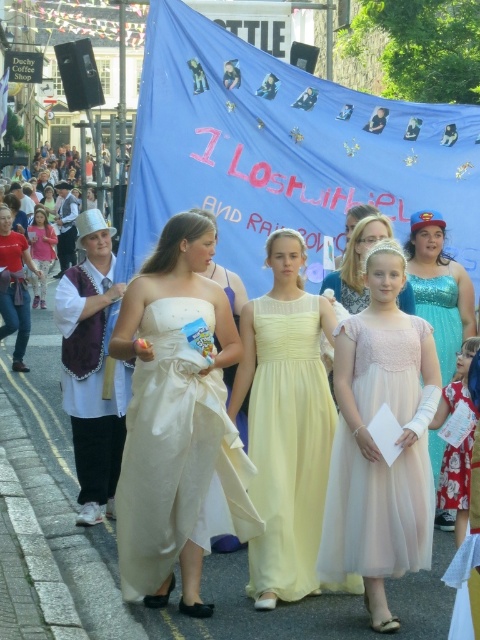
Describe the element at coordinates (286, 422) in the screenshot. I see `light yellow satin dress at center` at that location.

Who is shorter, light yellow satin dress at center or pale pink tulle dress at center?

Standing shorter between the two is light yellow satin dress at center.

Is point (240, 390) closer to viewer compared to point (403, 364)?

No, it is behind (403, 364).

Locate an element on the screen. This screenshot has height=640, width=480. light yellow satin dress at center is located at coordinates (286, 422).

Between ivory satin dress at center and light pink satin dress at center, which one has more height?

light pink satin dress at center

Is ivory satin dress at center behind light pink satin dress at center?

No, it is not.

In order to click on ivory satin dress at center in this screenshot , I will do (178, 420).

Can you confirm if ivory satin dress at center is taller than light yellow satin dress at center?

Correct, ivory satin dress at center is much taller as light yellow satin dress at center.

Between point (202, 237) and point (300, 472), which one is positioned behind?

The point (202, 237) is more distant.

Is point (142, 289) behind point (276, 493)?

That is True.

Locate an element on the screen. ivory satin dress at center is located at coordinates (178, 420).